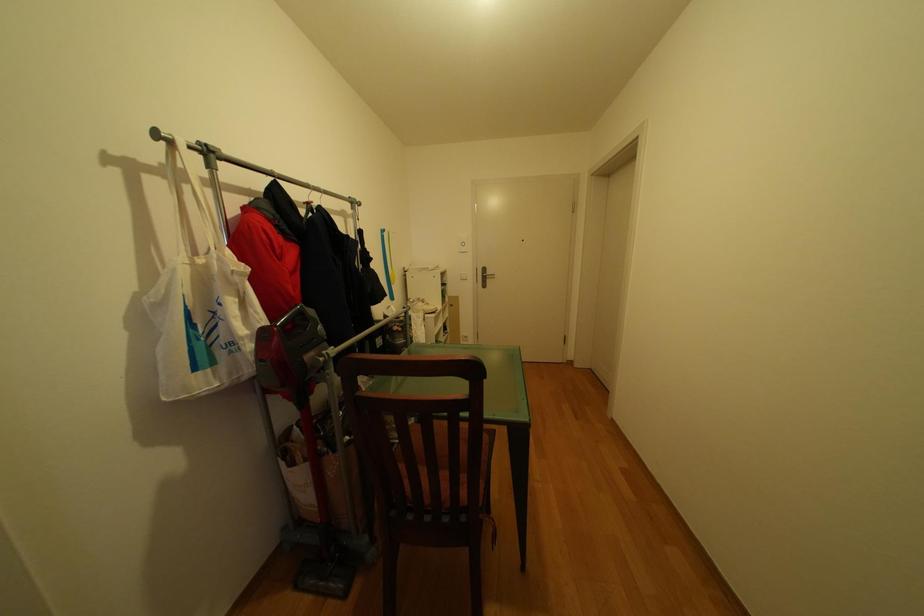
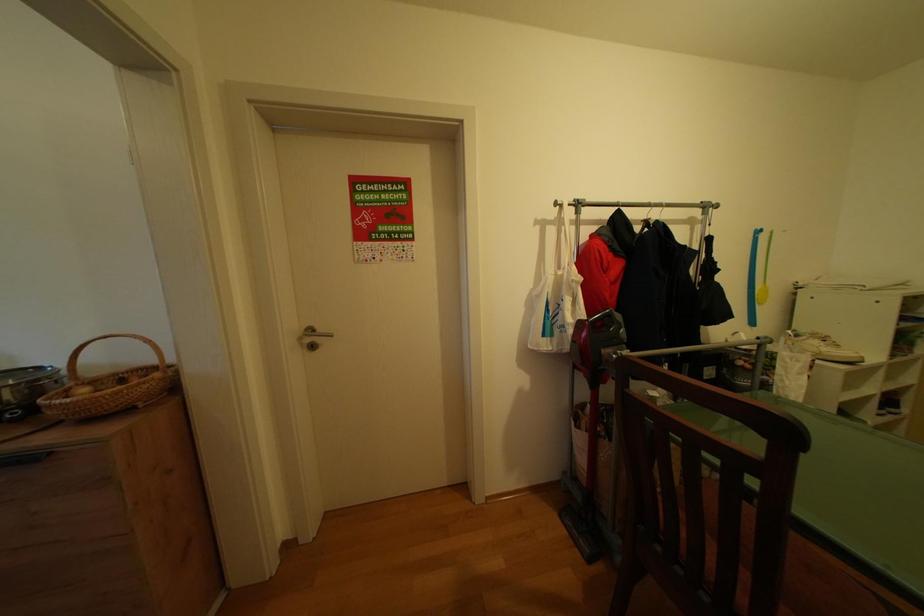
Question: The camera is either moving clockwise (left) or counter-clockwise (right) around the object. The first image is from the beginning of the video and the second image is from the end. Is the camera moving left or right when shooting the video?

Choices:
 (A) Left
 (B) Right

Answer: (B)